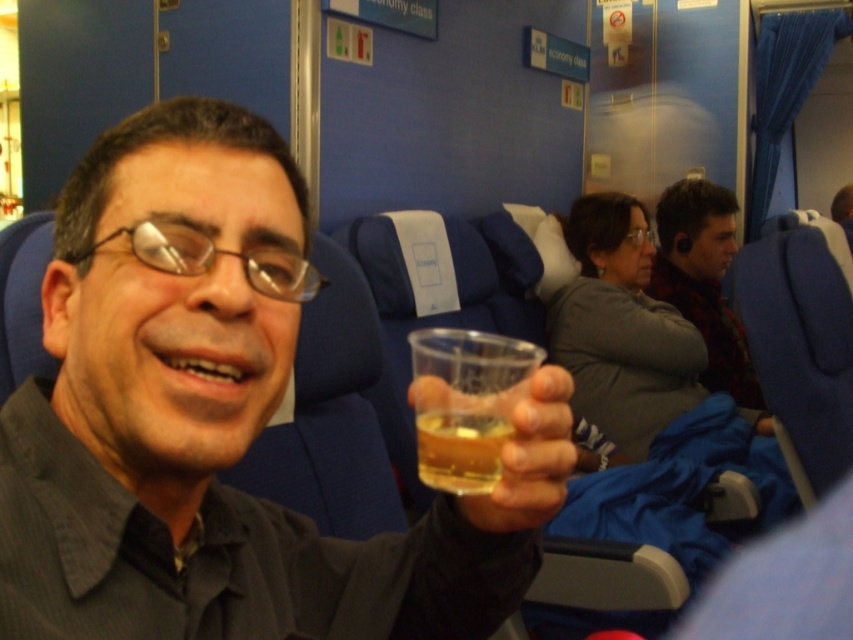
Image resolution: width=853 pixels, height=640 pixels. Describe the element at coordinates (219, 420) in the screenshot. I see `clear plastic cup at center` at that location.

Can you confirm if clear plastic cup at center is positioned to the right of flannel shirt at center?

No, clear plastic cup at center is not to the right of flannel shirt at center.

I want to click on clear plastic cup at center, so click(219, 420).

Locate an element on the screen. This screenshot has height=640, width=853. clear plastic cup at center is located at coordinates (219, 420).

Is point (375, 582) positioned before point (490, 468)?

No, it is behind (490, 468).

Based on the photo, is clear plastic cup at center to the right of translucent plastic cup at center from the viewer's perspective?

No, clear plastic cup at center is not to the right of translucent plastic cup at center.

Which is behind, point (247, 140) or point (476, 436)?

The point (247, 140) is behind.

This screenshot has width=853, height=640. In order to click on clear plastic cup at center in this screenshot , I will do `click(219, 420)`.

Consider the image. Does flannel shirt at center appear on the left side of translucent plastic cup at center?

Incorrect, flannel shirt at center is not on the left side of translucent plastic cup at center.

Does flannel shirt at center have a lesser height compared to translucent plastic cup at center?

In fact, flannel shirt at center may be taller than translucent plastic cup at center.

This screenshot has width=853, height=640. What do you see at coordinates (703, 280) in the screenshot?
I see `flannel shirt at center` at bounding box center [703, 280].

Find the location of a particular element. flannel shirt at center is located at coordinates (703, 280).